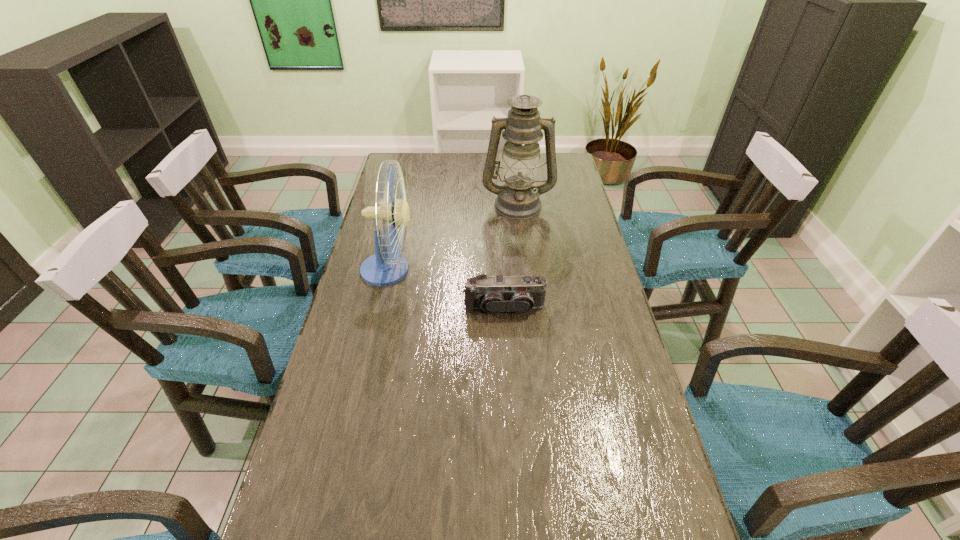
Locate which object ranks in proximity to the shortest object. Please provide its 2D coordinates. Your answer should be formatted as a tuple, i.e. [(x, y)], where the tuple contains the x and y coordinates of a point satisfying the conditions above.

[(384, 268)]

Locate an element on the screen. The image size is (960, 540). free space in the image that satisfies the following two spatial constraints: 1. on the front side of the farthest object; 2. at the front of the leftmost object where the blades are visible is located at coordinates (525, 269).